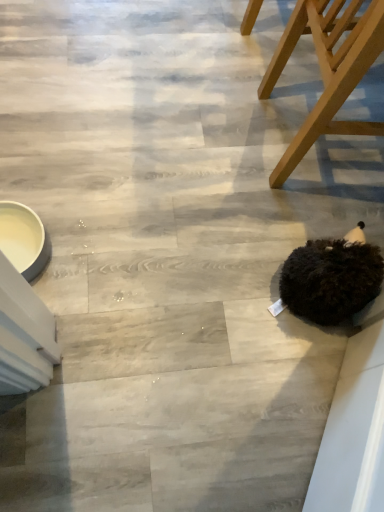
Question: From the image's perspective, does black fuzzy ball at lower right appear higher than wooden chair at upper right?

Choices:
 (A) no
 (B) yes

Answer: (A)

Question: Is black fuzzy ball at lower right closer to the viewer compared to wooden chair at upper right?

Choices:
 (A) no
 (B) yes

Answer: (A)

Question: Considering the relative sizes of black fuzzy ball at lower right and wooden chair at upper right in the image provided, is black fuzzy ball at lower right bigger than wooden chair at upper right?

Choices:
 (A) no
 (B) yes

Answer: (A)

Question: Is black fuzzy ball at lower right positioned with its back to wooden chair at upper right?

Choices:
 (A) no
 (B) yes

Answer: (A)

Question: Considering the relative positions of black fuzzy ball at lower right and wooden chair at upper right in the image provided, is black fuzzy ball at lower right to the right of wooden chair at upper right from the viewer's perspective?

Choices:
 (A) yes
 (B) no

Answer: (B)

Question: Is black fuzzy ball at lower right oriented towards wooden chair at upper right?

Choices:
 (A) yes
 (B) no

Answer: (A)

Question: Is wooden chair at upper right next to black fuzzy ball at lower right and touching it?

Choices:
 (A) yes
 (B) no

Answer: (B)

Question: Does wooden chair at upper right come behind black fuzzy ball at lower right?

Choices:
 (A) yes
 (B) no

Answer: (B)

Question: From the image's perspective, would you say wooden chair at upper right is shown under black fuzzy ball at lower right?

Choices:
 (A) no
 (B) yes

Answer: (A)

Question: From the image's perspective, is wooden chair at upper right above black fuzzy ball at lower right?

Choices:
 (A) no
 (B) yes

Answer: (B)

Question: From a real-world perspective, is wooden chair at upper right physically below black fuzzy ball at lower right?

Choices:
 (A) no
 (B) yes

Answer: (A)

Question: Is wooden chair at upper right bigger than black fuzzy ball at lower right?

Choices:
 (A) yes
 (B) no

Answer: (A)

Question: Relative to wooden chair at upper right, is black fuzzy ball at lower right in front or behind?

Choices:
 (A) behind
 (B) front

Answer: (A)